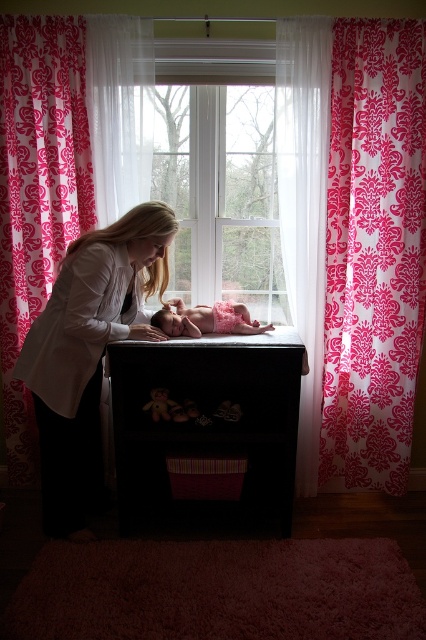
You are organizing a baby shower and need to place the pink satin dress at center on the changing table. Where exactly should you place it relative to the baby?

The pink satin dress at center should be placed at the coordinates point [206,320] relative to the baby.

You are designing a nursery and want to place a large decorative item near the velvety brown teddy bear at center. The pink damask curtain at left is already present. Based on their sizes, which object would be more suitable for placing a large item next to the teddy bear?

The pink damask curtain at left is larger in size than the velvety brown teddy bear at center, so placing a large decorative item next to the teddy bear would be better suited near the pink damask curtain at left since it can accommodate larger items due to its bigger size.